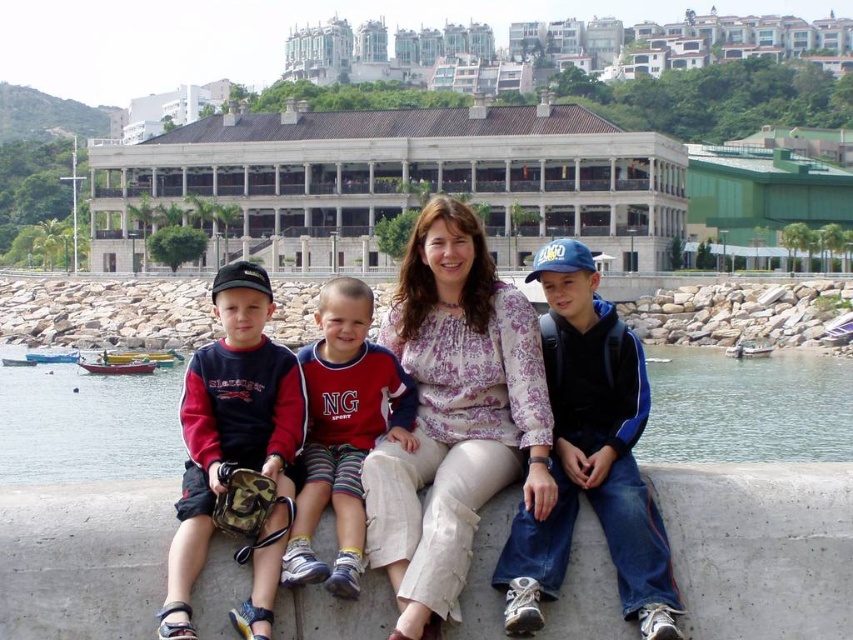
Is point (561, 438) behind point (270, 532)?

Yes, point (561, 438) is behind point (270, 532).

The height and width of the screenshot is (640, 853). What are the coordinates of `blue denim jeans at center` in the screenshot? It's located at (589, 456).

Is point (39, 452) positioned before point (625, 397)?

No, (39, 452) is further to viewer.

Who is positioned more to the left, clear water at lower center or blue denim jeans at center?

Positioned to the left is clear water at lower center.

Between point (848, 454) and point (508, 621), which one is positioned in front?

Positioned in front is point (508, 621).

This screenshot has height=640, width=853. In order to click on clear water at lower center in this screenshot , I will do `click(747, 408)`.

Based on the photo, can you confirm if matte blue jacket at center is positioned below light purple floral blouse at center?

Yes, matte blue jacket at center is below light purple floral blouse at center.

Does matte blue jacket at center have a lesser height compared to light purple floral blouse at center?

Yes, matte blue jacket at center is shorter than light purple floral blouse at center.

The width and height of the screenshot is (853, 640). I want to click on matte blue jacket at center, so click(x=496, y=420).

Find the location of `matte blue jacket at center`. matte blue jacket at center is located at coordinates [x=496, y=420].